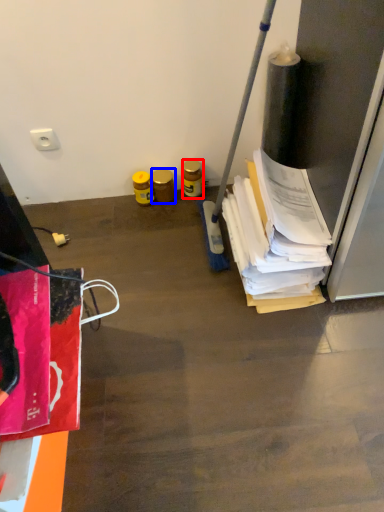
Question: Which object is further to the camera taking this photo, bottle (highlighted by a red box) or bottle (highlighted by a blue box)?

Choices:
 (A) bottle
 (B) bottle

Answer: (B)